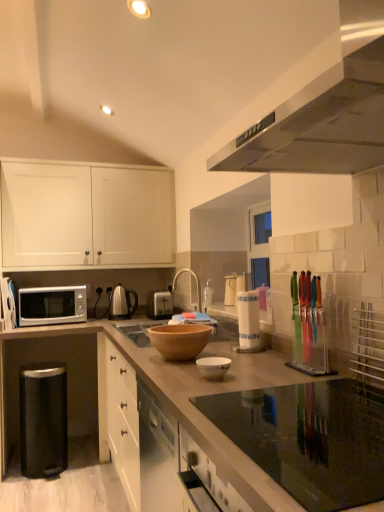
Question: Relative to silver metallic microwave at lower left, is white matte cabinet at upper left in front or behind?

Choices:
 (A) front
 (B) behind

Answer: (B)

Question: Does point (71, 168) appear closer or farther from the camera than point (41, 323)?

Choices:
 (A) closer
 (B) farther

Answer: (B)

Question: Estimate the real-world distances between objects in this image. Which object is farther from the brown matte bowl at center?

Choices:
 (A) silver metallic microwave at left, marked as the fifth appliance in a right-to-left arrangement
 (B) white matte cabinet at upper left
 (C) silver metallic faucet at center
 (D) white paper towel holder at center, the 3th appliance in the left-to-right sequence
 (E) satin nickel tea kettle at center

Answer: (E)

Question: Based on their relative distances, which object is farther from the white glossy bowl at center?

Choices:
 (A) clear plastic knife block at right, marked as the first appliance in a front-to-back arrangement
 (B) brown wooden bowl at center
 (C) silver metallic microwave at left, the 2th appliance from the back
 (D) silver metallic toaster at center, the 5th appliance viewed from the front
 (E) silver metallic faucet at center

Answer: (C)